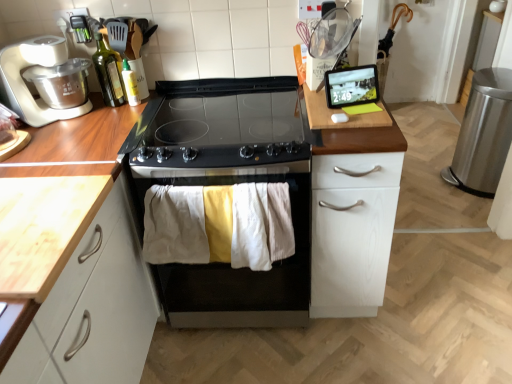
This screenshot has width=512, height=384. I want to click on free space to the right of white matte cabinet at right, so click(x=431, y=283).